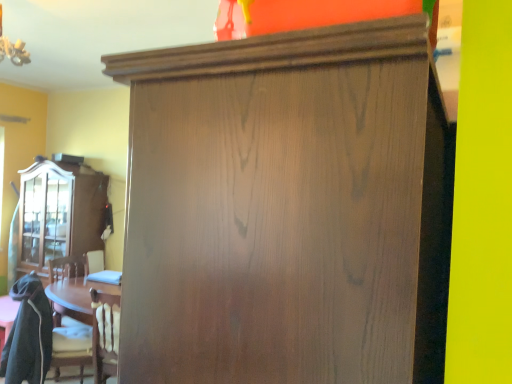
Question: From a real-world perspective, is satin wood cupboard at center above or below wooden swivel chair at lower left?

Choices:
 (A) above
 (B) below

Answer: (A)

Question: Considering their positions, is satin wood cupboard at center located in front of or behind wooden swivel chair at lower left?

Choices:
 (A) behind
 (B) front

Answer: (B)

Question: Which object is positioned farthest from the matte wood cabinet at left?

Choices:
 (A) wooden swivel chair at lower left
 (B) satin wood cupboard at center

Answer: (B)

Question: Considering the real-world distances, which object is closest to the wooden swivel chair at lower left?

Choices:
 (A) satin wood cupboard at center
 (B) matte wood cabinet at left

Answer: (B)